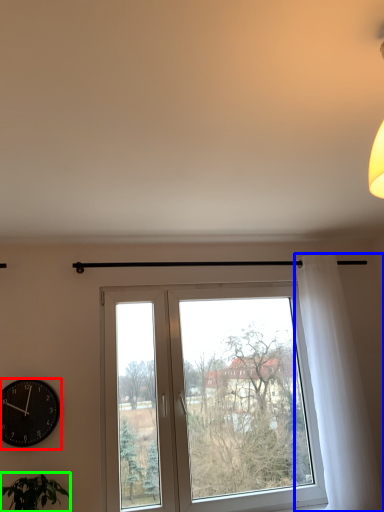
Question: Which object is positioned farthest from wall clock (highlighted by a red box)? Select from curtain (highlighted by a blue box) and houseplant (highlighted by a green box).

Choices:
 (A) curtain
 (B) houseplant

Answer: (A)